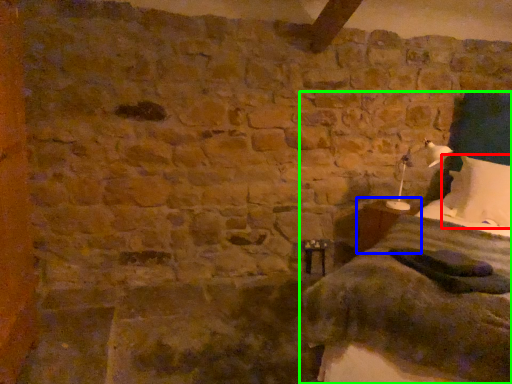
Question: Which object is the farthest from pillow (highlighted by a red box)? Choose among these: table (highlighted by a blue box) or bed (highlighted by a green box).

Choices:
 (A) table
 (B) bed

Answer: (A)